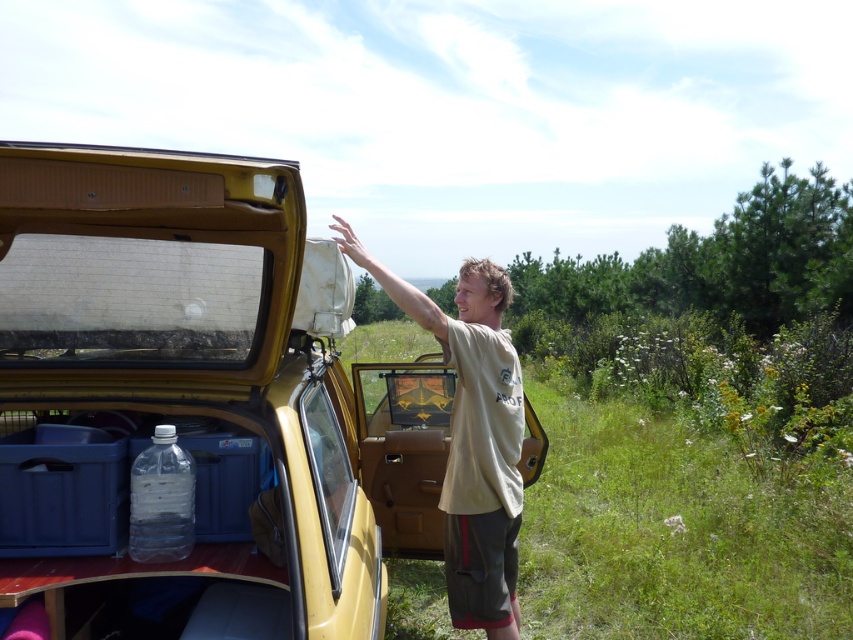
Where is `beige cotton t-shirt at center`? The width and height of the screenshot is (853, 640). beige cotton t-shirt at center is located at coordinates (473, 436).

Between beige cotton t-shirt at center and clear plastic bottle at lower left, which one is positioned lower?

beige cotton t-shirt at center

The width and height of the screenshot is (853, 640). Identify the location of beige cotton t-shirt at center. (473, 436).

This screenshot has height=640, width=853. Find the location of `beige cotton t-shirt at center`. beige cotton t-shirt at center is located at coordinates (473, 436).

Between yellow matte car at center and clear plastic bottle at lower left, which one has more height?

With more height is yellow matte car at center.

Is yellow matte car at center taller than clear plastic bottle at lower left?

Correct, yellow matte car at center is much taller as clear plastic bottle at lower left.

What do you see at coordinates (196, 400) in the screenshot? Image resolution: width=853 pixels, height=640 pixels. I see `yellow matte car at center` at bounding box center [196, 400].

In order to click on yellow matte car at center in this screenshot , I will do 196,400.

Between yellow matte car at center and beige cotton t-shirt at center, which one appears on the right side from the viewer's perspective?

Positioned to the right is beige cotton t-shirt at center.

What do you see at coordinates (196, 400) in the screenshot? I see `yellow matte car at center` at bounding box center [196, 400].

Between point (80, 340) and point (500, 582), which one is positioned behind?

Point (500, 582)

Identify the location of yellow matte car at center. The image size is (853, 640). (196, 400).